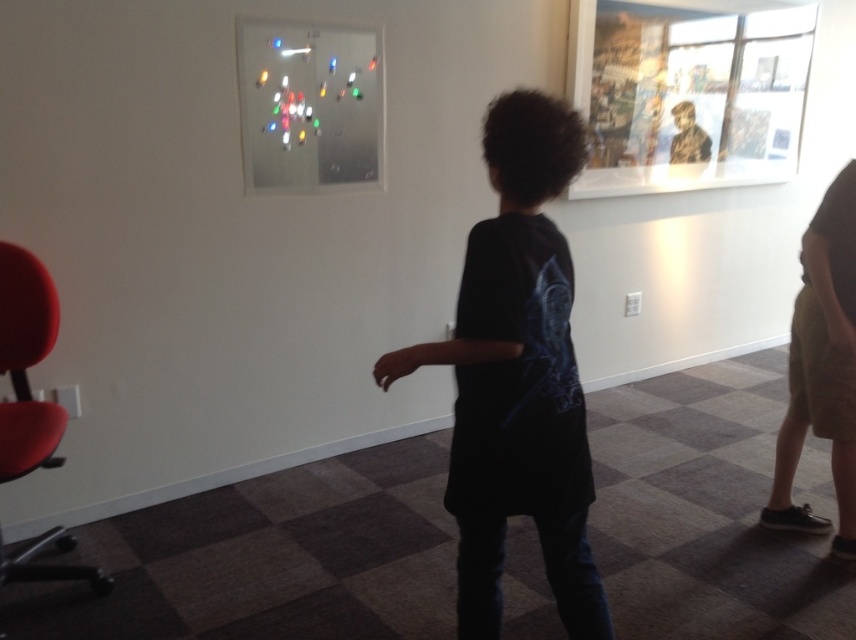
You are standing in the gallery and want to move from the point at coordinates (571,292) to the point at (21,561). Which direction should you move relative to your current position?

You should move downward and to the right because the point at (21,561) is located lower and further to the right compared to the point at (571,292).

From the picture: You are standing in the gallery and want to touch the camouflage fabric poster at upper right. The point you need to reach is at coordinates (690, 99). Can you estimate if this point is on the camouflage fabric poster at upper right?

Yes, the point (690, 99) is on the camouflage fabric poster at upper right according to the description.